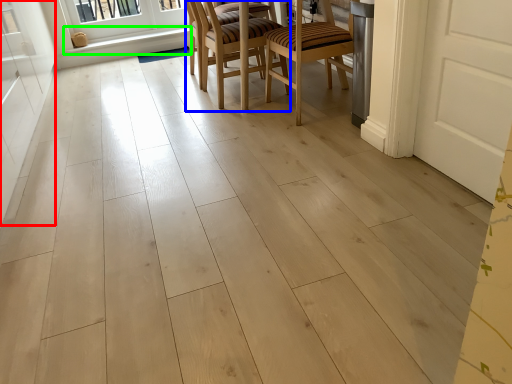
Question: Which object is positioned closest to screen door (highlighted by a red box)? Select from chair (highlighted by a blue box) and window sill (highlighted by a green box).

Choices:
 (A) chair
 (B) window sill

Answer: (A)